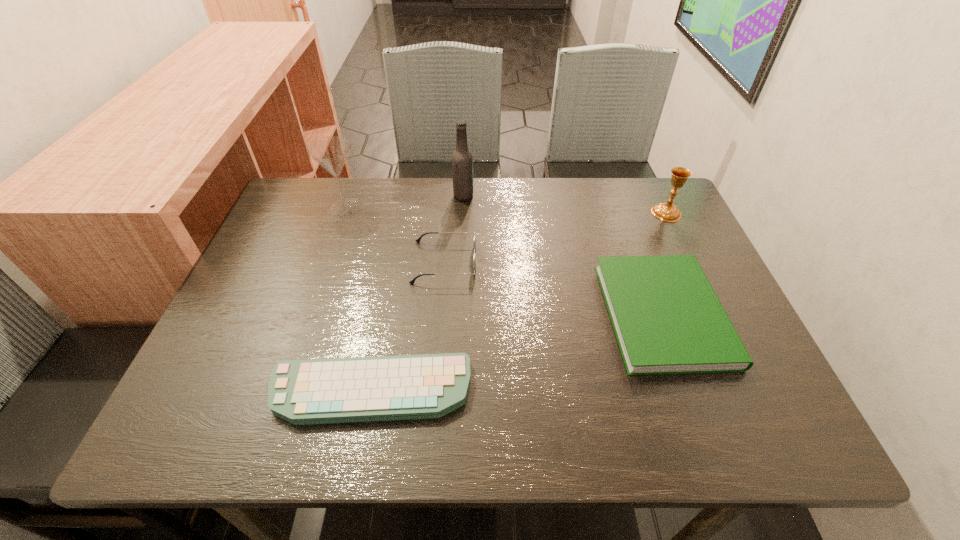
Where is `free space that satisfies the following two spatial constraints: 1. on the label of the tallest object; 2. on the front side of the shortest object`? This screenshot has height=540, width=960. free space that satisfies the following two spatial constraints: 1. on the label of the tallest object; 2. on the front side of the shortest object is located at coordinates (455, 390).

The image size is (960, 540). What are the coordinates of `vacant space that satisfies the following two spatial constraints: 1. on the label of the tallest object; 2. on the left side of the second shortest object` in the screenshot? It's located at (458, 314).

Locate an element on the screen. blank space that satisfies the following two spatial constraints: 1. on the label of the second shortest object; 2. on the left side of the beer bottle is located at coordinates click(458, 314).

Where is `vacant region that satisfies the following two spatial constraints: 1. on the back side of the second shortest object; 2. on the front-facing side of the sunglasses`? The height and width of the screenshot is (540, 960). vacant region that satisfies the following two spatial constraints: 1. on the back side of the second shortest object; 2. on the front-facing side of the sunglasses is located at coordinates (644, 262).